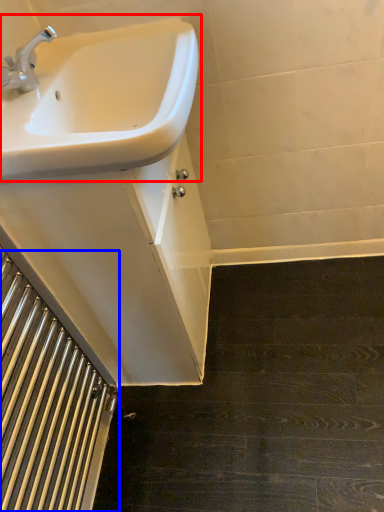
Question: Which object appears closest to the camera in this image, sink (highlighted by a red box) or stairwell (highlighted by a blue box)?

Choices:
 (A) sink
 (B) stairwell

Answer: (B)